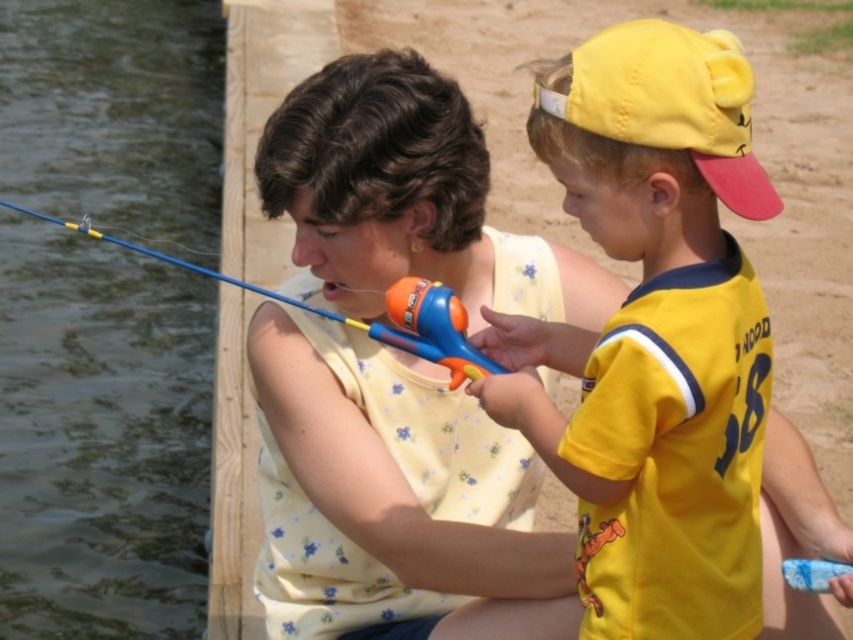
Question: Is yellow matte cap at upper right smaller than blue plastic toy at lower right?

Choices:
 (A) no
 (B) yes

Answer: (A)

Question: Which of the following is the farthest from the observer?

Choices:
 (A) (457, 364)
 (B) (628, 188)

Answer: (A)

Question: Is yellow fabric baseball cap at upper right bigger than blue plastic fishing pole at upper left?

Choices:
 (A) yes
 (B) no

Answer: (B)

Question: Which object is the closest to the blue plastic fishing pole at upper left?

Choices:
 (A) blue plastic toy at lower right
 (B) transparent water at fishing pole left
 (C) yellow matte cap at upper right

Answer: (C)

Question: In this image, where is yellow matte cap at upper right located relative to blue plastic toy at lower right?

Choices:
 (A) below
 (B) above

Answer: (B)

Question: Which point appears farthest from the camera in this image?

Choices:
 (A) click(149, 256)
 (B) click(21, 4)

Answer: (B)